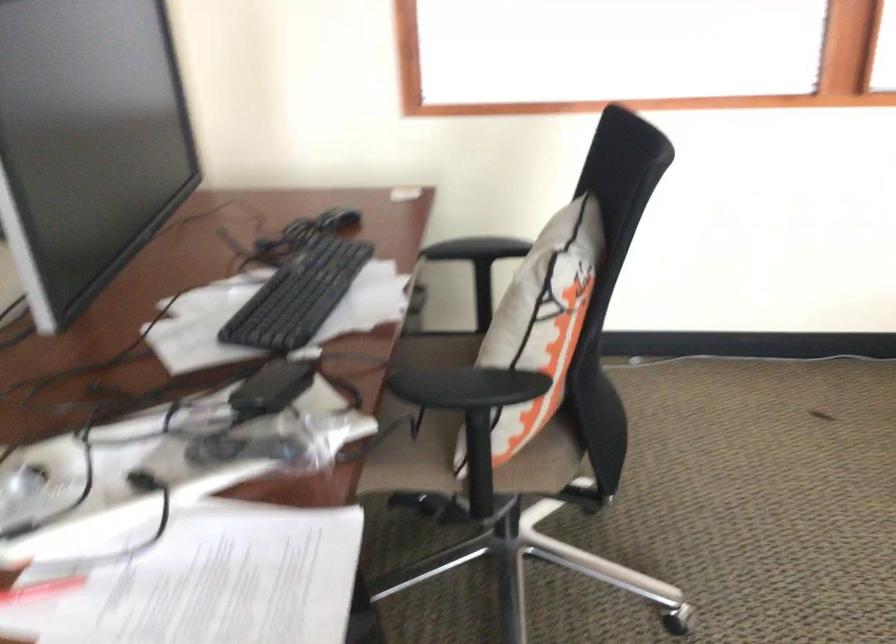
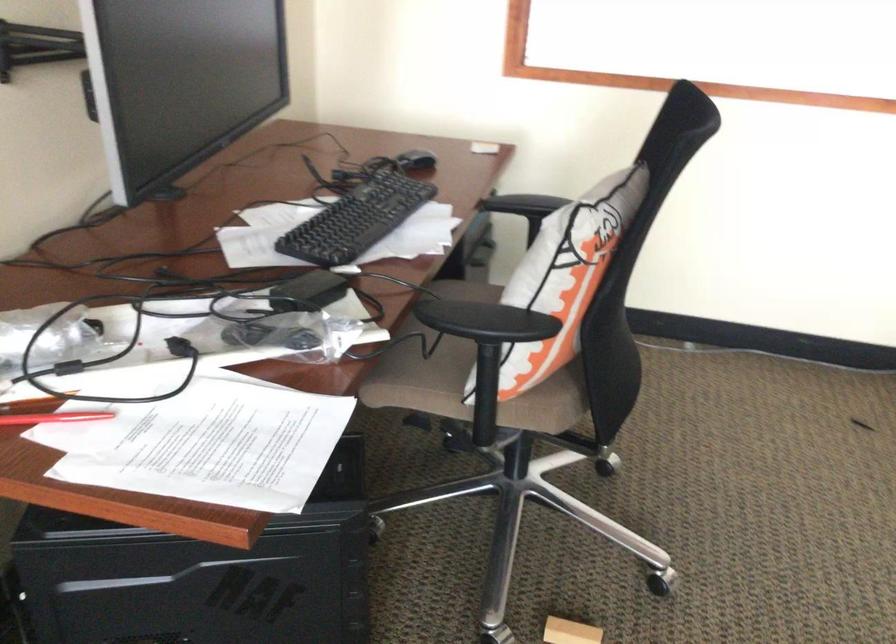
Find the pixel in the second image that matches (x=538, y=468) in the first image.

(543, 408)